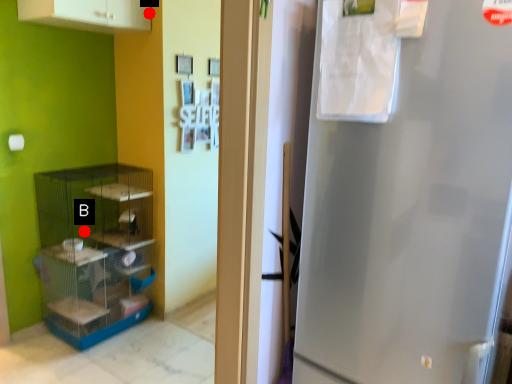
Question: Two points are circled on the image, labeled by A and B beside each circle. Which of the following is the farthest from the observer?

Choices:
 (A) A is further
 (B) B is further

Answer: (B)